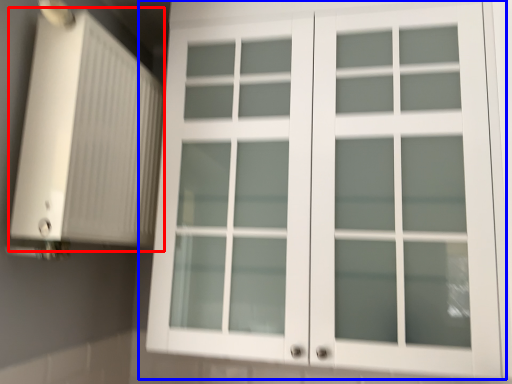
Question: Which point is closer to the camera, air conditioning (highlighted by a red box) or cupboard (highlighted by a blue box)?

Choices:
 (A) air conditioning
 (B) cupboard

Answer: (A)